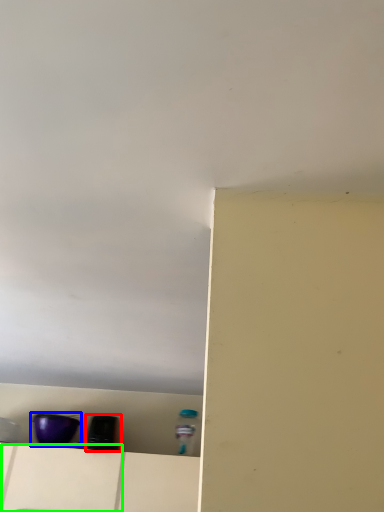
Question: Estimate the real-world distances between objects in this image. Which object is farther from appliance (highlighted by a red box), appliance (highlighted by a blue box) or drawer (highlighted by a green box)?

Choices:
 (A) appliance
 (B) drawer

Answer: (B)